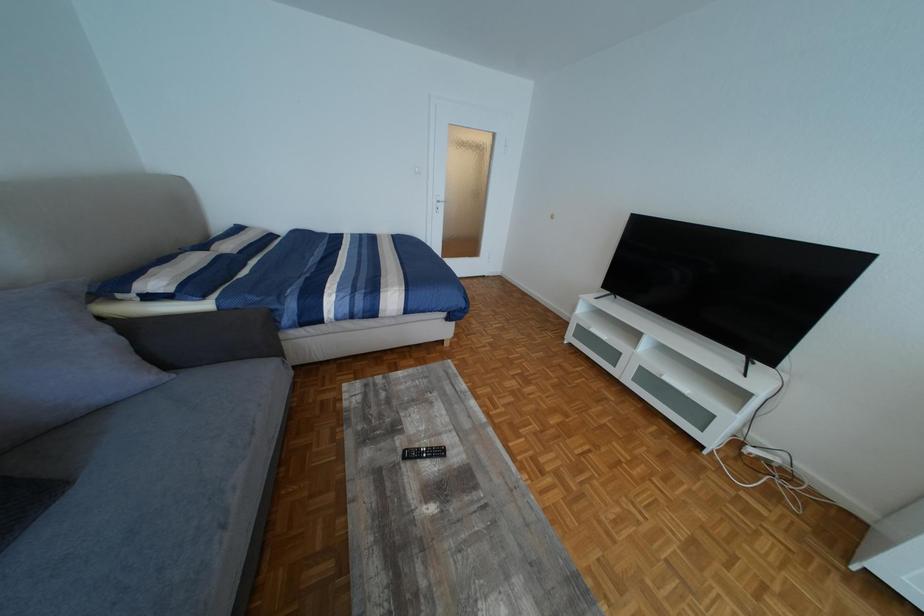
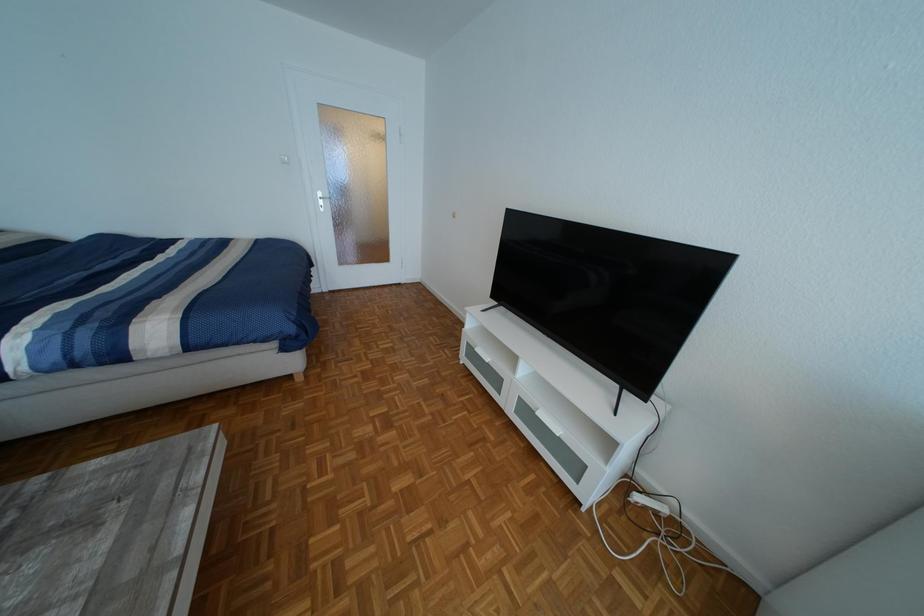
In a continuous first-person perspective shot, in which direction is the camera moving?

The cameraman walked toward right, forward.